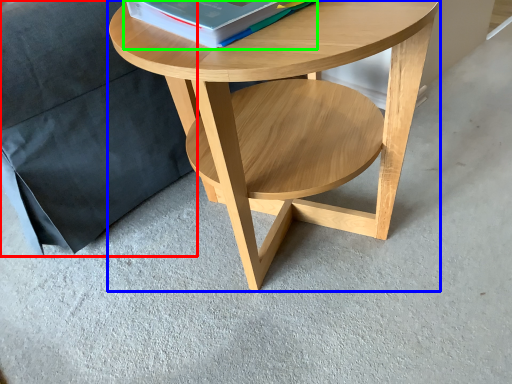
Question: Which object is positioned closest to pillow (highlighted by a red box)? Select from coffee table (highlighted by a blue box) and paperback book (highlighted by a green box).

Choices:
 (A) coffee table
 (B) paperback book

Answer: (A)